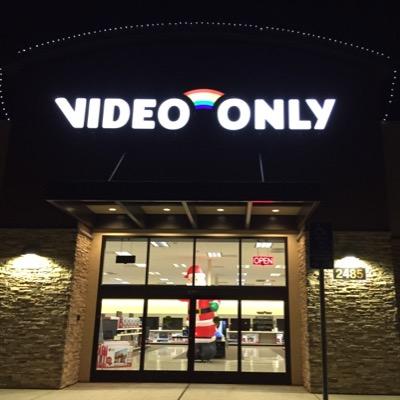
Locate an element on the screen. wall is located at coordinates (336, 302).